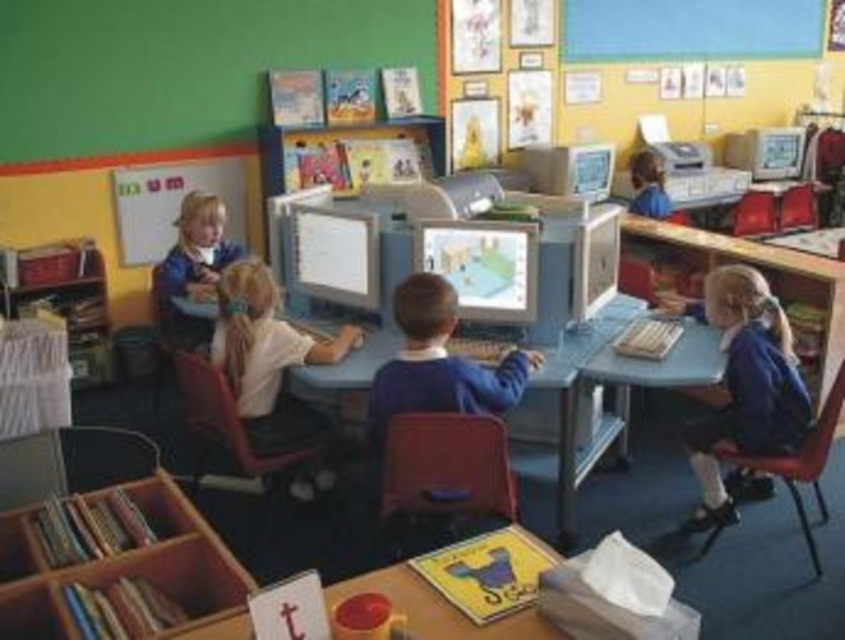
You are a teacher in this classroom. You need to place a new laptop on the largest object in the scene. Which object should you choose between the matte plastic monitor at center and the wooden bookshelf at left?

The wooden bookshelf at left is larger than the matte plastic monitor at center, so you should place the new laptop on the wooden bookshelf at left.

You are a student sitting at your desk in the classroom. You notice the matte plastic monitor at center and the white matte chalkboard at upper left. Which object is positioned higher up in the image?

The white matte chalkboard at upper left is positioned higher up in the image than the matte plastic monitor at center.

Looking at the classroom scene, which object is larger between the matte plastic monitor at center and the white matte chalkboard at upper left?

The white matte chalkboard at upper left is larger than the matte plastic monitor at center.